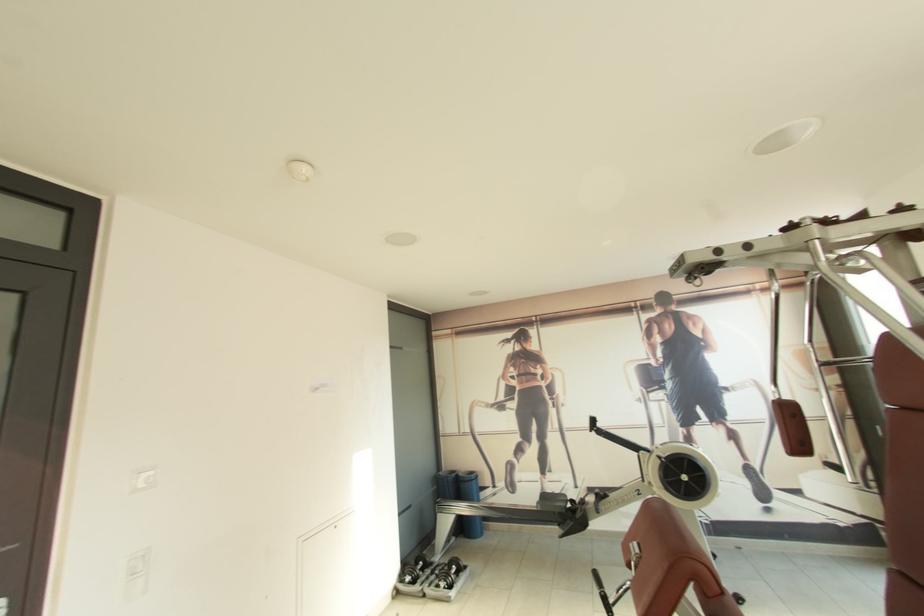
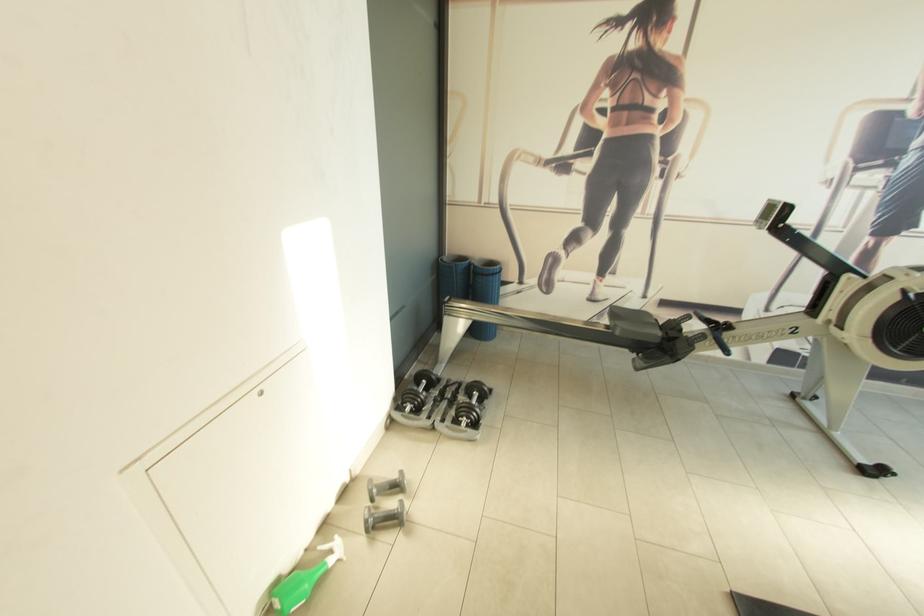
Locate, in the second image, the point that corresponds to (x=599, y=421) in the first image.

(792, 209)